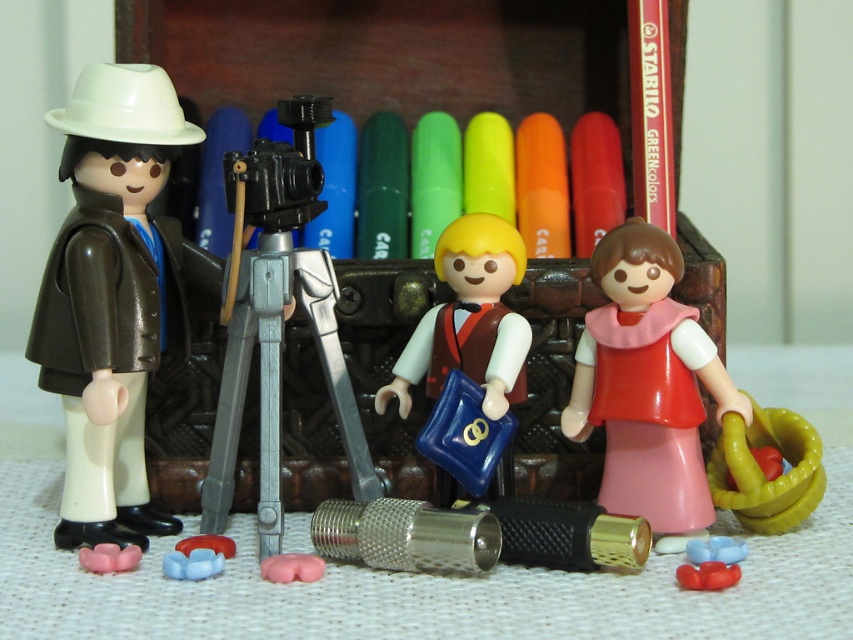
Question: In this image, where is pink matte dress at center located relative to pink rubber flower at lower left?

Choices:
 (A) above
 (B) below

Answer: (A)

Question: Among these points, which one is nearest to the camera?

Choices:
 (A) (108, 554)
 (B) (419, 339)
 (C) (759, 472)

Answer: (A)

Question: Can you confirm if matte brown jacket at left is positioned to the right of pink rubber flower at lower left?

Choices:
 (A) yes
 (B) no

Answer: (A)

Question: Estimate the real-world distances between objects in this image. Which object is closer to the matte brown jacket at left?

Choices:
 (A) pink rubber flower at lower left
 (B) green rubber rings at right

Answer: (A)

Question: Which of the following is the farthest from the observer?

Choices:
 (A) (769, 502)
 (B) (119, 568)

Answer: (A)

Question: Is pink matte dress at center to the right of smooth brown vest at center from the viewer's perspective?

Choices:
 (A) yes
 (B) no

Answer: (A)